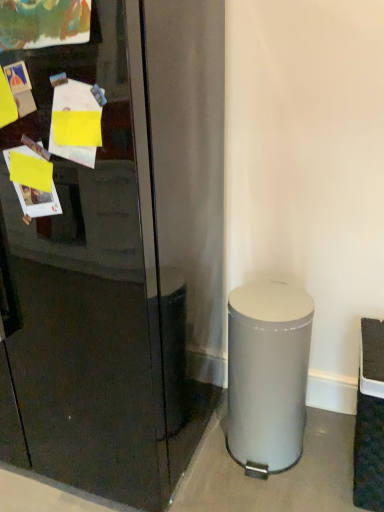
The image size is (384, 512). Find the location of `glossy black refrigerator at center`. glossy black refrigerator at center is located at coordinates (84, 292).

The width and height of the screenshot is (384, 512). Describe the element at coordinates (84, 292) in the screenshot. I see `glossy black refrigerator at center` at that location.

Identify the location of silver metallic trash can at lower right. (268, 373).

In order to face silver metallic trash can at lower right, should I rotate leftwards or rightwards?

It's best to rotate right around 9.656 degrees.

What do you see at coordinates (268, 373) in the screenshot? I see `silver metallic trash can at lower right` at bounding box center [268, 373].

This screenshot has width=384, height=512. I want to click on glossy black refrigerator at center, so click(x=84, y=292).

Is silver metallic trash can at lower right to the right of glossy black refrigerator at center from the viewer's perspective?

Yes, silver metallic trash can at lower right is to the right of glossy black refrigerator at center.

Is silver metallic trash can at lower right in front of glossy black refrigerator at center?

No, silver metallic trash can at lower right is behind glossy black refrigerator at center.

Is point (269, 407) less distant than point (115, 92)?

No, (269, 407) is further to viewer.

From the image's perspective, does silver metallic trash can at lower right appear lower than glossy black refrigerator at center?

Yes, from the image's perspective, silver metallic trash can at lower right is beneath glossy black refrigerator at center.

From a real-world perspective, is silver metallic trash can at lower right beneath glossy black refrigerator at center?

Correct, in the physical world, silver metallic trash can at lower right is lower than glossy black refrigerator at center.

Considering the sizes of objects silver metallic trash can at lower right and glossy black refrigerator at center in the image provided, who is wider, silver metallic trash can at lower right or glossy black refrigerator at center?

glossy black refrigerator at center is wider.

Considering the relative sizes of silver metallic trash can at lower right and glossy black refrigerator at center in the image provided, is silver metallic trash can at lower right taller than glossy black refrigerator at center?

In fact, silver metallic trash can at lower right may be shorter than glossy black refrigerator at center.

Considering the relative sizes of silver metallic trash can at lower right and glossy black refrigerator at center in the image provided, is silver metallic trash can at lower right bigger than glossy black refrigerator at center?

Incorrect, silver metallic trash can at lower right is not larger than glossy black refrigerator at center.

Is silver metallic trash can at lower right situated inside glossy black refrigerator at center or outside?

silver metallic trash can at lower right is located beyond the bounds of glossy black refrigerator at center.

Are silver metallic trash can at lower right and glossy black refrigerator at center far apart?

No.

Is silver metallic trash can at lower right oriented away from glossy black refrigerator at center?

silver metallic trash can at lower right does not have its back to glossy black refrigerator at center.

How far apart are silver metallic trash can at lower right and glossy black refrigerator at center?

silver metallic trash can at lower right is 19.93 inches from glossy black refrigerator at center.

What are the coordinates of `trash bin/can behind the glossy black refrigerator at center` in the screenshot? It's located at (268, 373).

In the image, is glossy black refrigerator at center on the left side or the right side of silver metallic trash can at lower right?

Based on their positions, glossy black refrigerator at center is located to the left of silver metallic trash can at lower right.

Which object is closer to the camera, glossy black refrigerator at center or silver metallic trash can at lower right?

glossy black refrigerator at center is in front.

Is point (77, 355) farther from viewer compared to point (307, 371)?

No, (77, 355) is in front of (307, 371).

From the image's perspective, is glossy black refrigerator at center positioned above or below silver metallic trash can at lower right?

glossy black refrigerator at center is situated higher than silver metallic trash can at lower right in the image.

From a real-world perspective, is glossy black refrigerator at center positioned over silver metallic trash can at lower right based on gravity?

Indeed, from a real-world perspective, glossy black refrigerator at center stands above silver metallic trash can at lower right.

Between glossy black refrigerator at center and silver metallic trash can at lower right, which one has larger width?

glossy black refrigerator at center is wider.

Does glossy black refrigerator at center have a greater height compared to silver metallic trash can at lower right?

Correct, glossy black refrigerator at center is much taller as silver metallic trash can at lower right.

In terms of size, does glossy black refrigerator at center appear bigger or smaller than silver metallic trash can at lower right?

Considering their sizes, glossy black refrigerator at center takes up more space than silver metallic trash can at lower right.

Is glossy black refrigerator at center outside of silver metallic trash can at lower right?

glossy black refrigerator at center is positioned outside silver metallic trash can at lower right.

Are glossy black refrigerator at center and silver metallic trash can at lower right located far from each other?

No, glossy black refrigerator at center is not far from silver metallic trash can at lower right.

Is glossy black refrigerator at center oriented away from silver metallic trash can at lower right?

No.

Where is `trash bin/can directly beneath the glossy black refrigerator at center (from a real-world perspective)`? This screenshot has height=512, width=384. trash bin/can directly beneath the glossy black refrigerator at center (from a real-world perspective) is located at coordinates (268, 373).

Find the location of a particular element. Image resolution: width=384 pixels, height=512 pixels. glass door lying in front of the silver metallic trash can at lower right is located at coordinates (84, 292).

Locate an element on the screen. The image size is (384, 512). trash bin/can that appears behind the glossy black refrigerator at center is located at coordinates (268, 373).